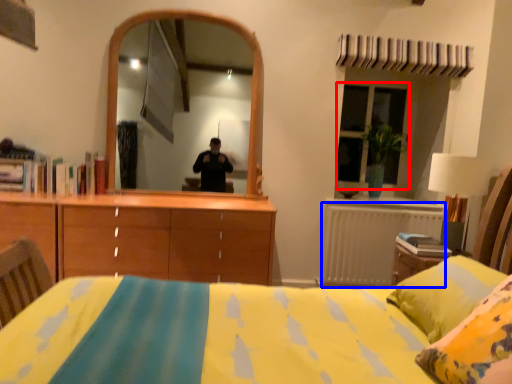
Question: Among these objects, which one is nearest to the camera, window (highlighted by a red box) or radiator (highlighted by a blue box)?

Choices:
 (A) window
 (B) radiator

Answer: (B)